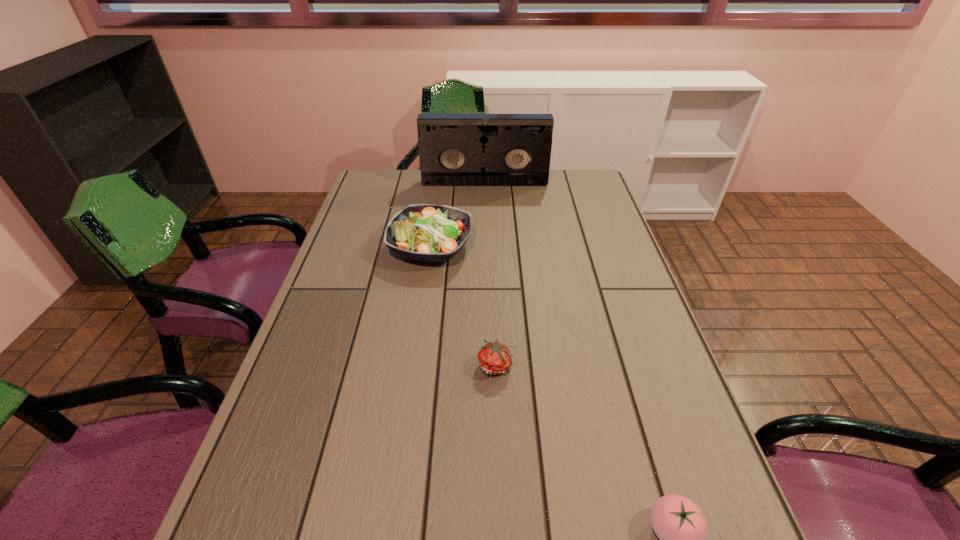
Identify the location of object that is at the left edge. The width and height of the screenshot is (960, 540). (425, 232).

The image size is (960, 540). What are the coordinates of `free point at the far edge` in the screenshot? It's located at (410, 187).

Locate an element on the screen. Image resolution: width=960 pixels, height=540 pixels. vacant space at the left edge is located at coordinates (398, 212).

In the image, there is a desktop. In order to click on free space at the right edge in this screenshot , I will do `click(620, 316)`.

In the image, there is a desktop. Where is `vacant space at the far left corner`? Image resolution: width=960 pixels, height=540 pixels. vacant space at the far left corner is located at coordinates (386, 181).

The width and height of the screenshot is (960, 540). In order to click on free space at the far right corner of the desktop in this screenshot , I will do `click(591, 187)`.

Locate an element on the screen. This screenshot has width=960, height=540. vacant space in between the shortest object and the videotape is located at coordinates (491, 274).

This screenshot has width=960, height=540. Identify the location of vacant area that lies between the tallest object and the second nearest object. (491, 274).

In order to click on vacant point located between the videotape and the left tomato in this screenshot , I will do `click(491, 274)`.

The width and height of the screenshot is (960, 540). What are the coordinates of `empty space between the farther tomato and the videotape` in the screenshot? It's located at (491, 274).